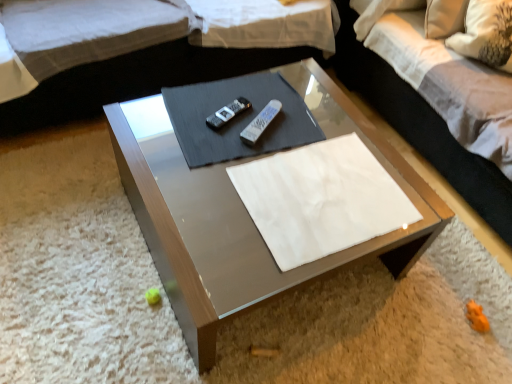
Question: Could white fabric pillow at upper right be considered to be inside white plastic remote at center, acting as the 1th remote starting from the right?

Choices:
 (A) no
 (B) yes

Answer: (A)

Question: Considering the relative sizes of white plastic remote at center, acting as the 1th remote starting from the right, and white fabric pillow at upper right in the image provided, is white plastic remote at center, acting as the 1th remote starting from the right, taller than white fabric pillow at upper right?

Choices:
 (A) yes
 (B) no

Answer: (B)

Question: Is white plastic remote at center, acting as the 1th remote starting from the right, far from white fabric pillow at upper right?

Choices:
 (A) no
 (B) yes

Answer: (A)

Question: Does white plastic remote at center, which is the second remote from left to right, turn towards white fabric pillow at upper right?

Choices:
 (A) yes
 (B) no

Answer: (B)

Question: Can we say white plastic remote at center, acting as the 1th remote starting from the right, lies outside white fabric pillow at upper right?

Choices:
 (A) yes
 (B) no

Answer: (A)

Question: From the image's perspective, does white plastic remote at center, which is the second remote from left to right, appear lower than white fabric pillow at upper right?

Choices:
 (A) no
 (B) yes

Answer: (B)

Question: Does white fabric pillow at upper right have a lesser width compared to white fabric couch at upper center?

Choices:
 (A) no
 (B) yes

Answer: (B)

Question: Is white fabric pillow at upper right to the right of white fabric couch at upper center from the viewer's perspective?

Choices:
 (A) yes
 (B) no

Answer: (A)

Question: Does white fabric pillow at upper right have a lesser height compared to white fabric couch at upper center?

Choices:
 (A) no
 (B) yes

Answer: (A)

Question: Is white fabric couch at upper center at the back of white fabric pillow at upper right?

Choices:
 (A) yes
 (B) no

Answer: (B)

Question: Is white fabric pillow at upper right at the left side of white fabric couch at upper center?

Choices:
 (A) yes
 (B) no

Answer: (B)

Question: Is white fabric pillow at upper right taller than white fabric couch at upper center?

Choices:
 (A) yes
 (B) no

Answer: (A)

Question: Could you tell me if white plastic remote at center, acting as the 1th remote starting from the right, is facing metallic glass coffee table at center?

Choices:
 (A) no
 (B) yes

Answer: (B)